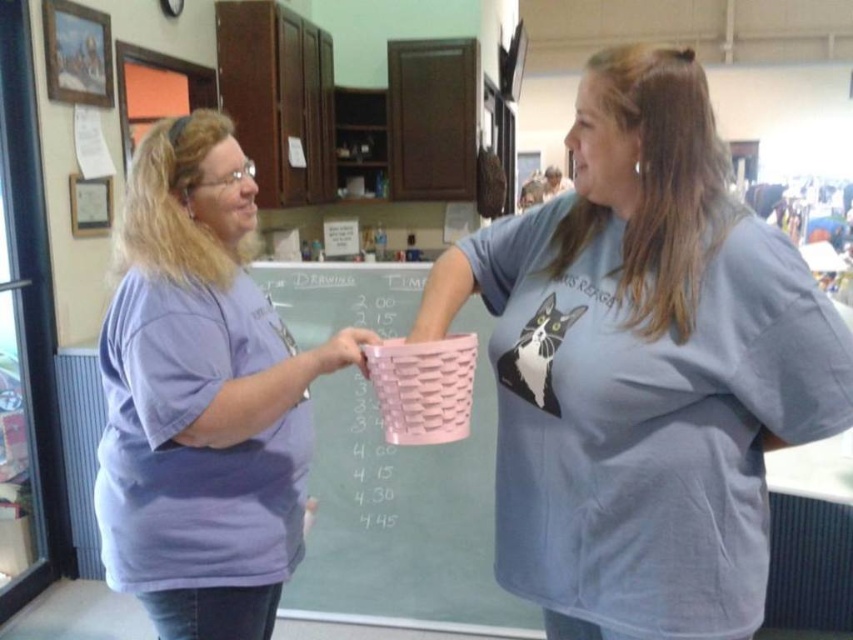
Based on the photo, you are standing in the community center and see two points marked on the wall. The first point is at coordinates point(x=508, y=260) and the second is at point(x=373, y=314). Which point is closer to you?

Point(x=508, y=260) is closer to the viewer than point(x=373, y=314).

You are standing in the community center and want to move from point A to point B. Point A is at coordinate point(590, 508) and point B is at coordinate point(199, 342). Which point is closer to you when you start at point A?

Point A is closer to the viewer than point B, so when you start at point A, point A is closer to you than point B.

You are organizing a small event at the community center and need to place two baskets in a specific order. The matte pink basket at center and the pink woven basket at center are both in the same location. Which basket should you move first to free up more space?

The matte pink basket at center occupies less space than the pink woven basket at center, so you should move the matte pink basket at center first to free up more space.